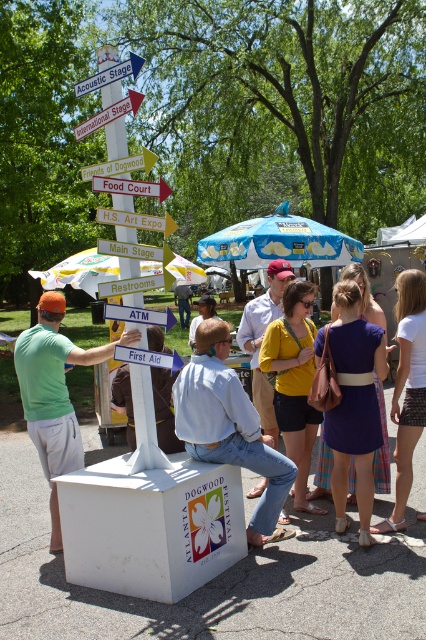
You are a visitor at the Atlanta Dogwood Festival and you see both the light blue denim shirt at center and the yellow wooden signpost at center. Which object would appear bigger to you?

The light blue denim shirt at center is larger in size than the yellow wooden signpost at center, so the light blue denim shirt at center would appear bigger.